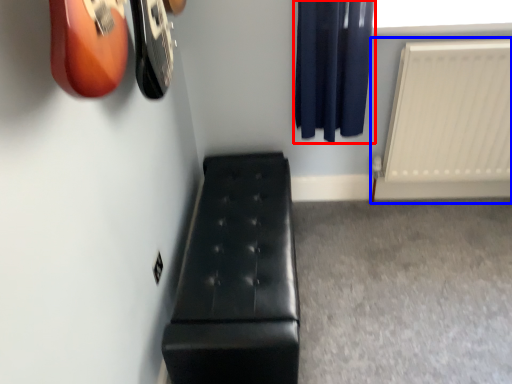
Question: Among these objects, which one is farthest to the camera, curtain (highlighted by a red box) or radiator (highlighted by a blue box)?

Choices:
 (A) curtain
 (B) radiator

Answer: (B)